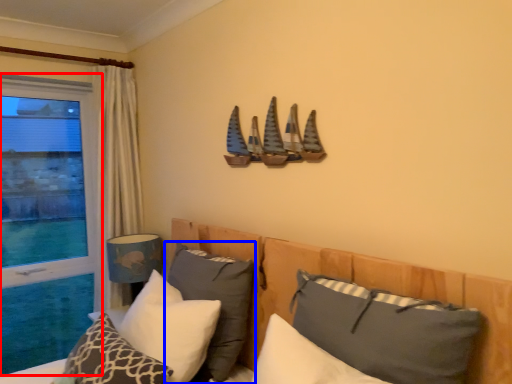
Question: Which point is closer to the camera, window (highlighted by a red box) or pillow (highlighted by a blue box)?

Choices:
 (A) window
 (B) pillow

Answer: (B)